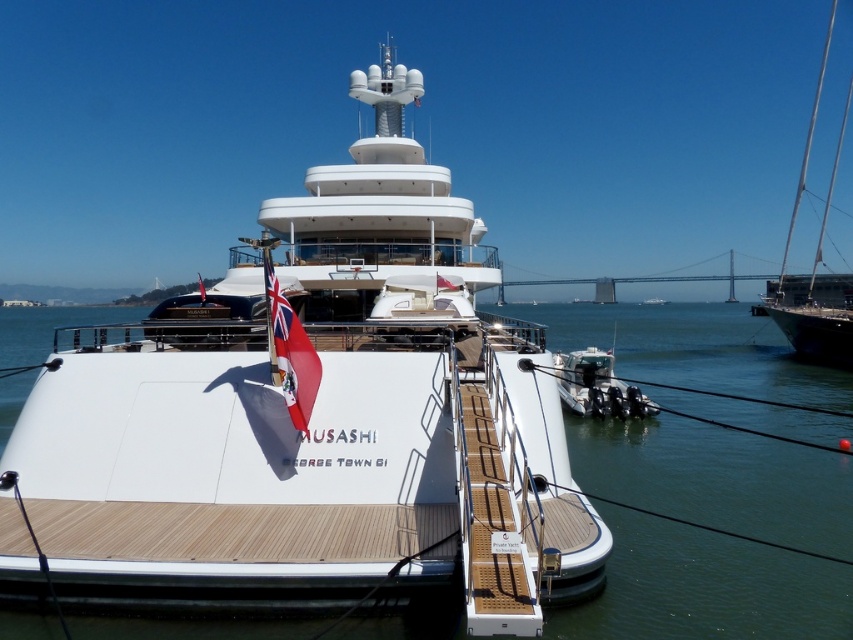
Is white wooden deck at center to the left of metallic silver mast at right from the viewer's perspective?

Yes, white wooden deck at center is to the left of metallic silver mast at right.

Between white wooden deck at center and metallic silver mast at right, which one is positioned lower?

white wooden deck at center

This screenshot has height=640, width=853. Describe the element at coordinates (705, 588) in the screenshot. I see `white wooden deck at center` at that location.

The width and height of the screenshot is (853, 640). In order to click on white wooden deck at center in this screenshot , I will do `click(705, 588)`.

Can you confirm if metallic silver mast at right is thinner than red fabric flag at lower left?

In fact, metallic silver mast at right might be wider than red fabric flag at lower left.

Locate an element on the screen. metallic silver mast at right is located at coordinates (814, 262).

Does white glossy yacht at center appear on the left side of metallic silver mast at right?

Indeed, white glossy yacht at center is positioned on the left side of metallic silver mast at right.

Measure the distance between white glossy yacht at center and camera.

white glossy yacht at center and camera are 6.63 meters apart from each other.

Image resolution: width=853 pixels, height=640 pixels. Find the location of `white glossy yacht at center`. white glossy yacht at center is located at coordinates (310, 422).